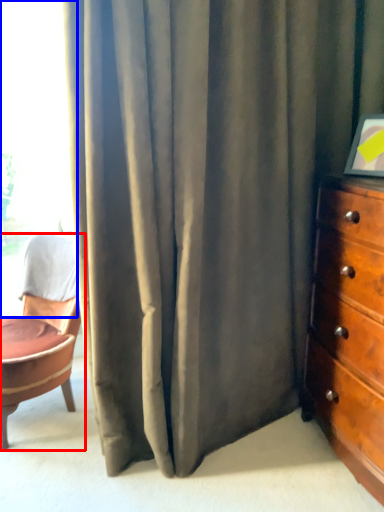
Question: Which object appears farthest to the camera in this image, chair (highlighted by a red box) or window (highlighted by a blue box)?

Choices:
 (A) chair
 (B) window

Answer: (B)